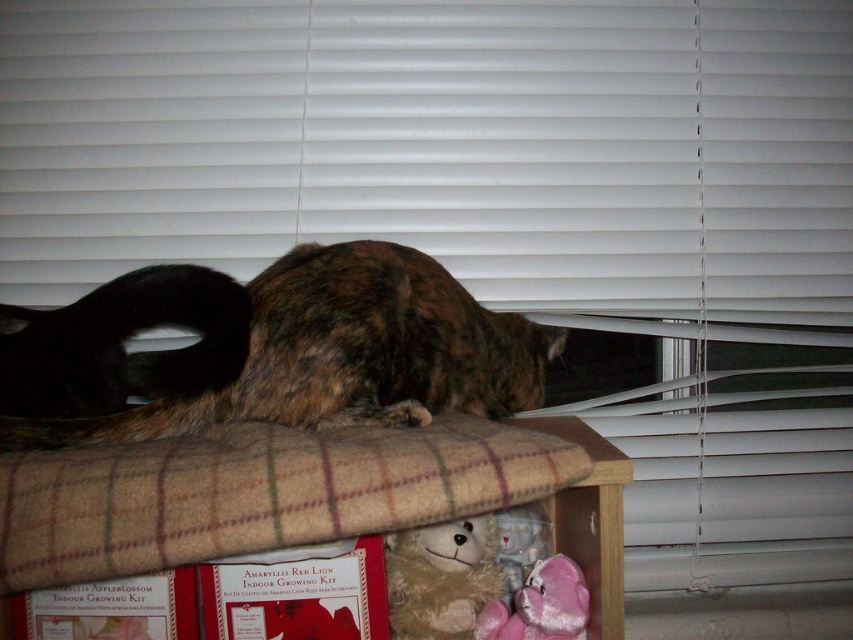
Question: Which object appears closest to the camera in this image?

Choices:
 (A) velvet pink teddy bear at lower right
 (B) brown fur cat at center
 (C) fluffy beige teddy bear at lower center

Answer: (B)

Question: Does fluffy beige teddy bear at lower center come behind velvet pink teddy bear at lower right?

Choices:
 (A) yes
 (B) no

Answer: (A)

Question: Does velvet pink teddy bear at lower right have a smaller size compared to fuzzy fabric teddy bear at lower center?

Choices:
 (A) yes
 (B) no

Answer: (B)

Question: Which of the following is the farthest from the observer?

Choices:
 (A) velvet pink teddy bear at lower right
 (B) brown fur cat at center
 (C) fuzzy fabric teddy bear at lower center

Answer: (C)

Question: Does brown fur cat at center lie in front of velvet pink teddy bear at lower right?

Choices:
 (A) no
 (B) yes

Answer: (B)

Question: Considering the real-world distances, which object is closest to the fuzzy fabric teddy bear at lower center?

Choices:
 (A) fluffy beige teddy bear at lower center
 (B) brown fur cat at center

Answer: (A)